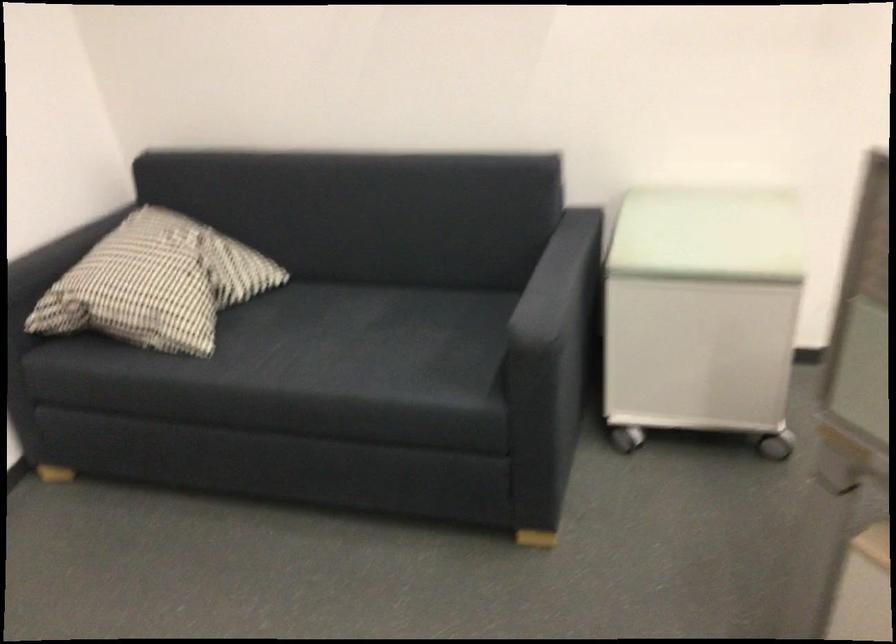
Find the location of a particular element. The height and width of the screenshot is (644, 896). sofa sitting surface is located at coordinates (410, 327).